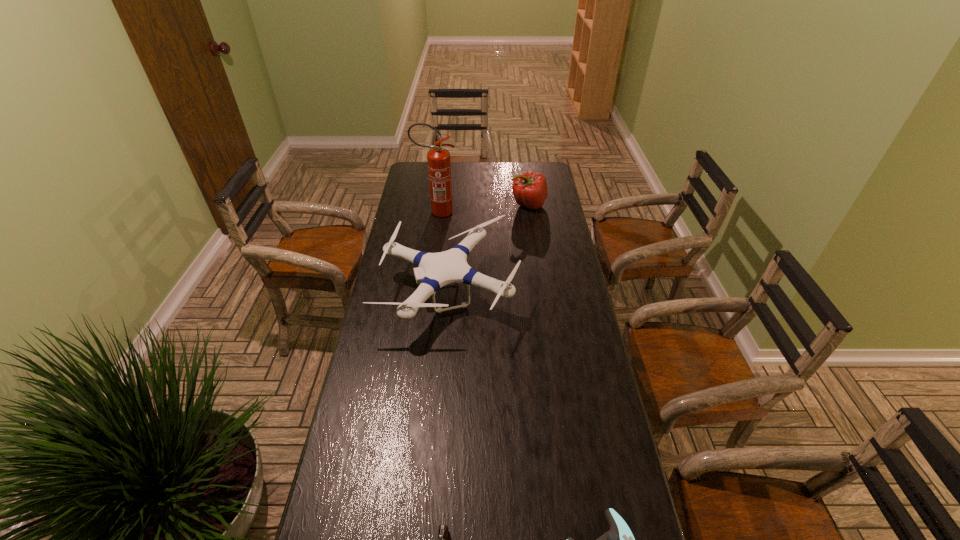
Where is `fire extinguisher`? The height and width of the screenshot is (540, 960). fire extinguisher is located at coordinates (439, 164).

Find the location of a particular element. Image resolution: width=960 pixels, height=540 pixels. drone is located at coordinates (435, 270).

Find the location of a particular element. bell pepper is located at coordinates (530, 190).

Locate an element on the screen. This screenshot has height=540, width=960. vacant region located 0.310m from the nozzle of the fire extinguisher is located at coordinates (525, 212).

Locate an element on the screen. The width and height of the screenshot is (960, 540). free spot located on the right of the drone is located at coordinates (540, 291).

Where is `vacant space located on the left of the bell pepper`? vacant space located on the left of the bell pepper is located at coordinates (491, 205).

Where is `fire extinguisher present at the left edge`? Image resolution: width=960 pixels, height=540 pixels. fire extinguisher present at the left edge is located at coordinates (439, 164).

You are a GUI agent. You are given a task and a screenshot of the screen. Output one action in this format:
    pyautogui.click(x=<x>, y=<y>)
    Task: Click on the drone at the left edge
    This screenshot has height=540, width=960.
    Given the screenshot: What is the action you would take?
    pyautogui.click(x=435, y=270)

Where is `object that is positioned at the right edge`? object that is positioned at the right edge is located at coordinates (530, 190).

At what (x,y) coordinates should I click in order to perform the action: click on free space at the left edge of the desktop. Please return your answer as a coordinate pair (x, y). The width and height of the screenshot is (960, 540). Looking at the image, I should click on (421, 222).